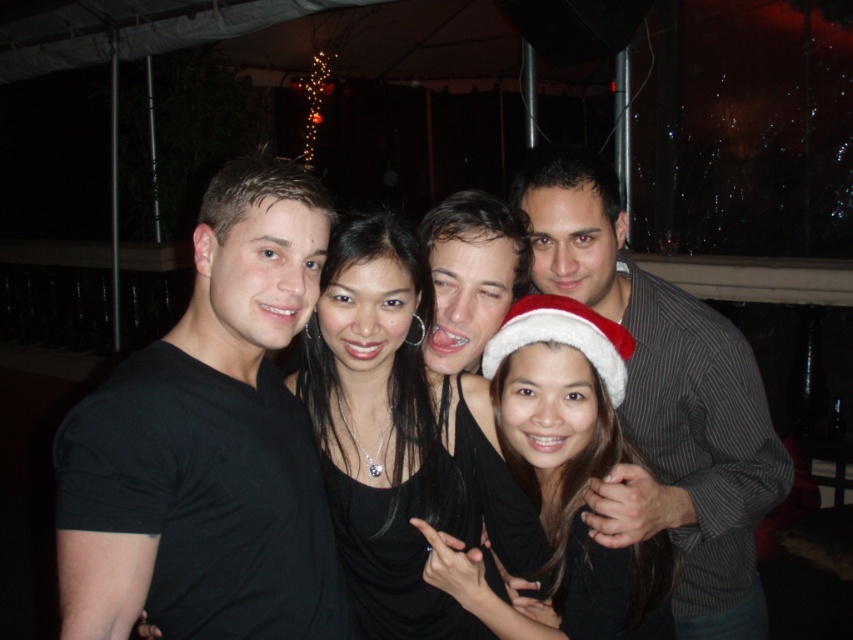
Is black matte t-shirt at left below striped fabric shirt at right?

Incorrect, black matte t-shirt at left is not positioned below striped fabric shirt at right.

Who is shorter, black matte t-shirt at left or striped fabric shirt at right?

black matte t-shirt at left

The height and width of the screenshot is (640, 853). I want to click on black matte t-shirt at left, so click(209, 444).

The height and width of the screenshot is (640, 853). I want to click on black matte santa hat at center, so click(561, 477).

Who is positioned more to the left, black matte santa hat at center or white fluffy santa hat at center?

black matte santa hat at center

Is point (628, 614) positioned before point (523, 314)?

That is False.

In order to click on black matte santa hat at center in this screenshot , I will do `click(561, 477)`.

In the scene shown: Which is more to the left, striped fabric shirt at right or black matte santa hat at center?

Positioned to the left is black matte santa hat at center.

The image size is (853, 640). Describe the element at coordinates (664, 401) in the screenshot. I see `striped fabric shirt at right` at that location.

What are the coordinates of `striped fabric shirt at right` in the screenshot? It's located at (664, 401).